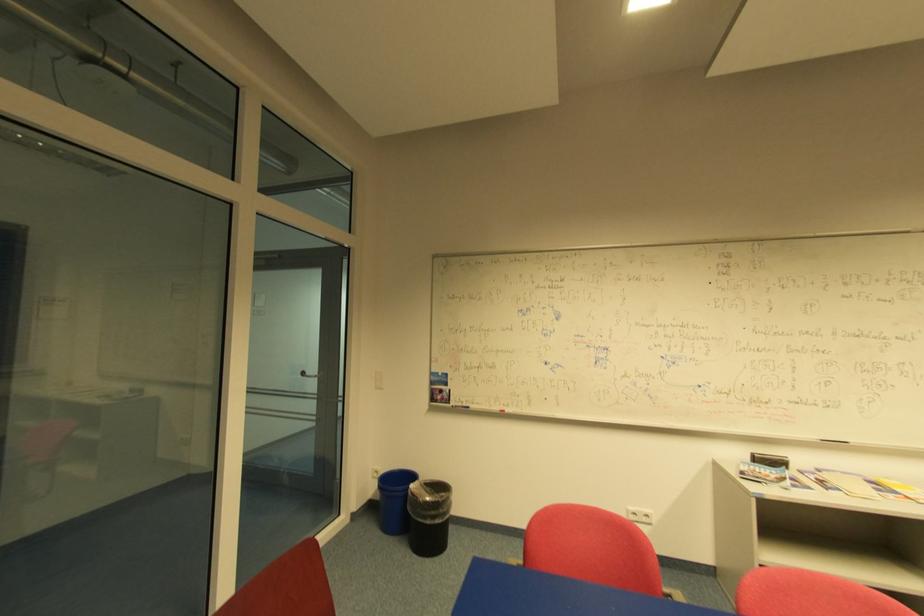
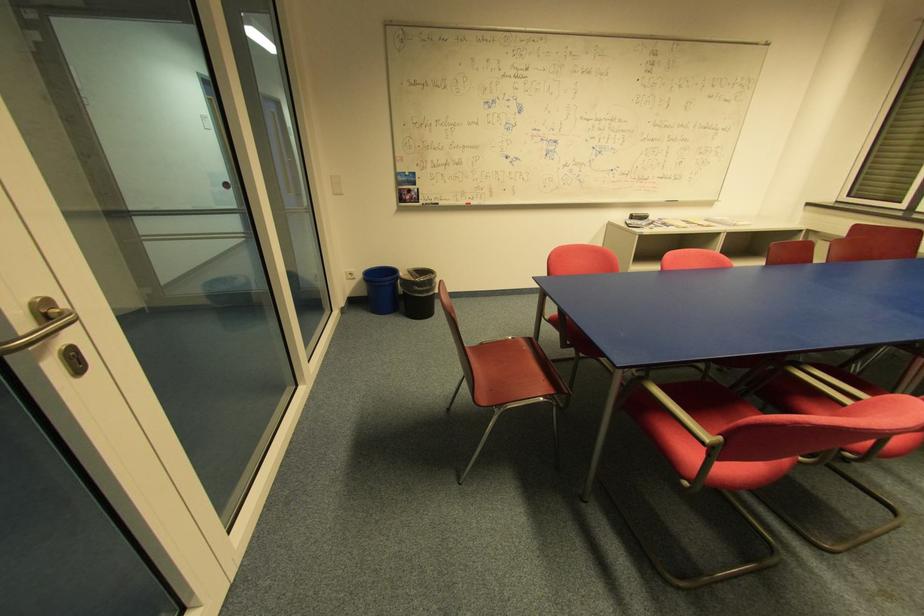
Locate, in the second image, the point that corresponds to pixel 417 479 in the first image.

(395, 273)